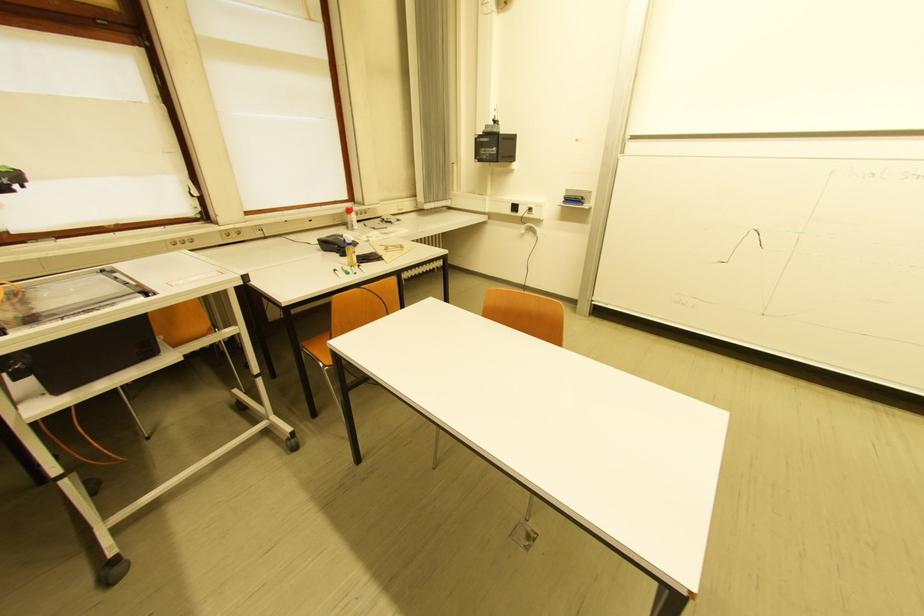
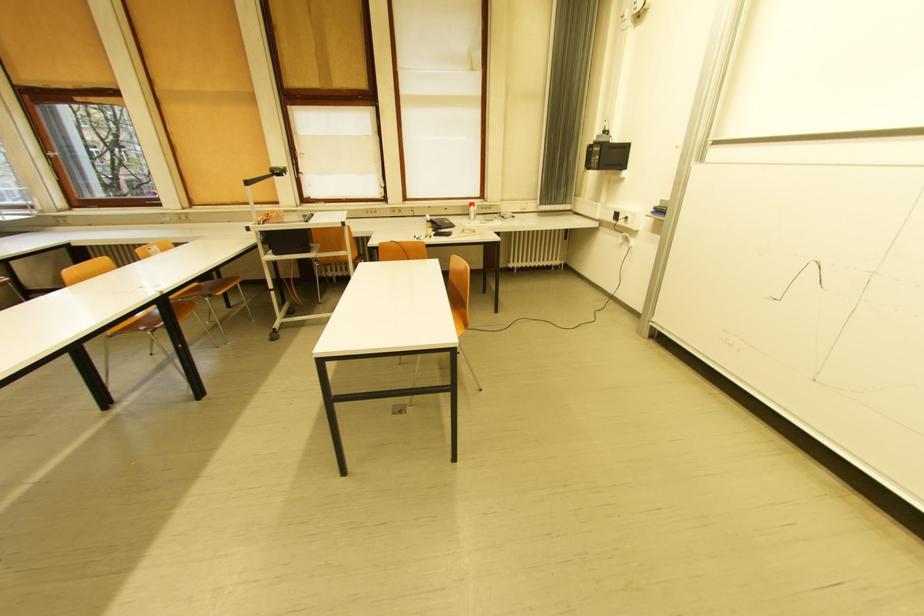
Question: I am providing you with two images of the same scene from different viewpoints. Please identify which objects are invisible in image2.

Choices:
 (A) red and white bottle
 (B) cart wheel
 (C) white ring binder
 (D) telephone handset

Answer: (B)